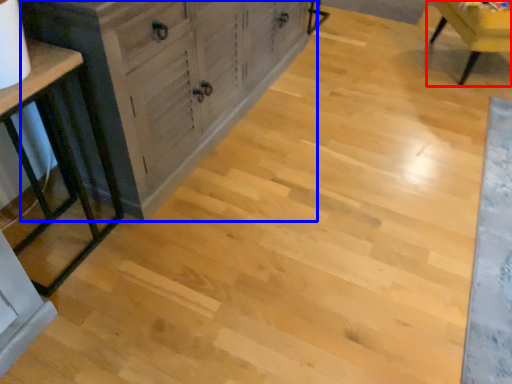
Question: Which point is closer to the camera, chair (highlighted by a red box) or cabinetry (highlighted by a blue box)?

Choices:
 (A) chair
 (B) cabinetry

Answer: (B)